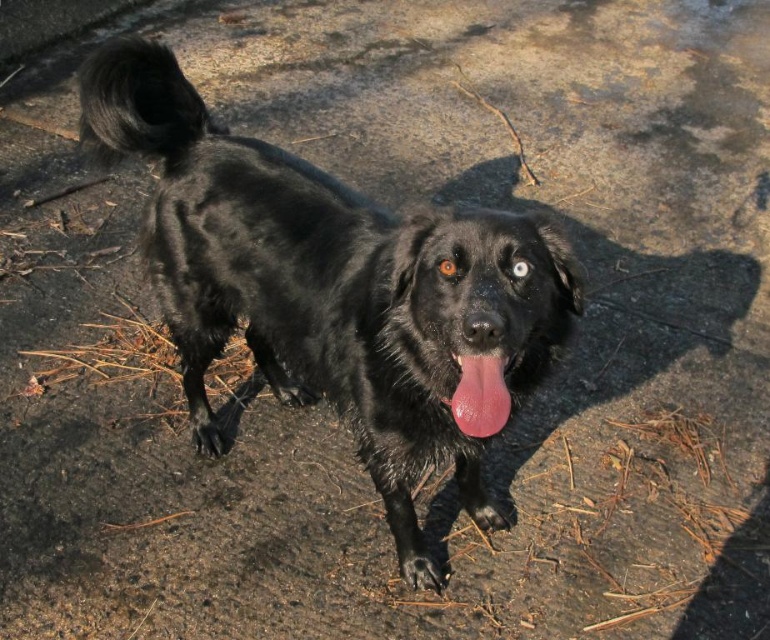
Who is positioned more to the right, shiny black dog at center or pink glossy tongue at center?

Positioned to the right is pink glossy tongue at center.

Measure the distance between point [208,115] and camera.

Point [208,115] is 2.18 meters from camera.

Which is in front, point (283, 177) or point (491, 419)?

Point (491, 419) is in front.

Where is `shiny black dog at center`? shiny black dog at center is located at coordinates (330, 285).